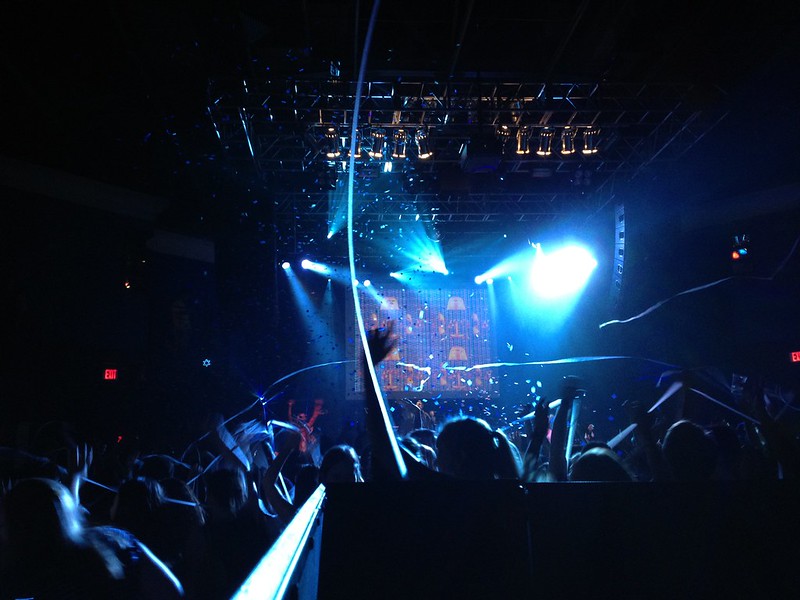
Identify the location of lights. (318, 275), (290, 266), (441, 272), (530, 260), (592, 144), (538, 151), (398, 144), (325, 132).